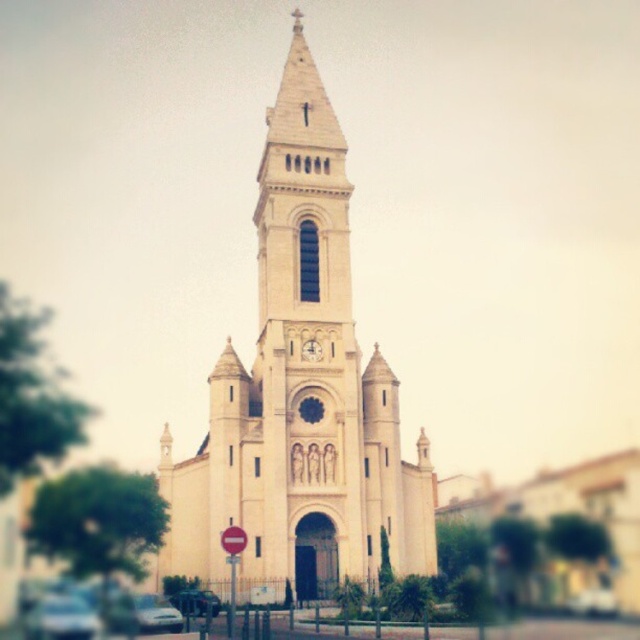
Question: Which of the following is the closest to the observer?

Choices:
 (A) (173, 618)
 (B) (188, 509)

Answer: (A)

Question: Which point is closer to the camera?

Choices:
 (A) white stone church at center
 (B) gold metallic clock at center
 (C) metallic silver car at lower left

Answer: (C)

Question: Can you confirm if white glossy car at lower left is positioned to the left of gold metallic clock at center?

Choices:
 (A) no
 (B) yes

Answer: (B)

Question: Which object is the closest to the white stone church at center?

Choices:
 (A) gold metallic clock at center
 (B) white glossy car at lower left
 (C) metallic silver car at lower left

Answer: (A)

Question: Is metallic silver car at lower left above gold metallic clock at center?

Choices:
 (A) yes
 (B) no

Answer: (B)

Question: Where is metallic silver car at lower center located in relation to gold metallic clock at center in the image?

Choices:
 (A) below
 (B) above

Answer: (A)